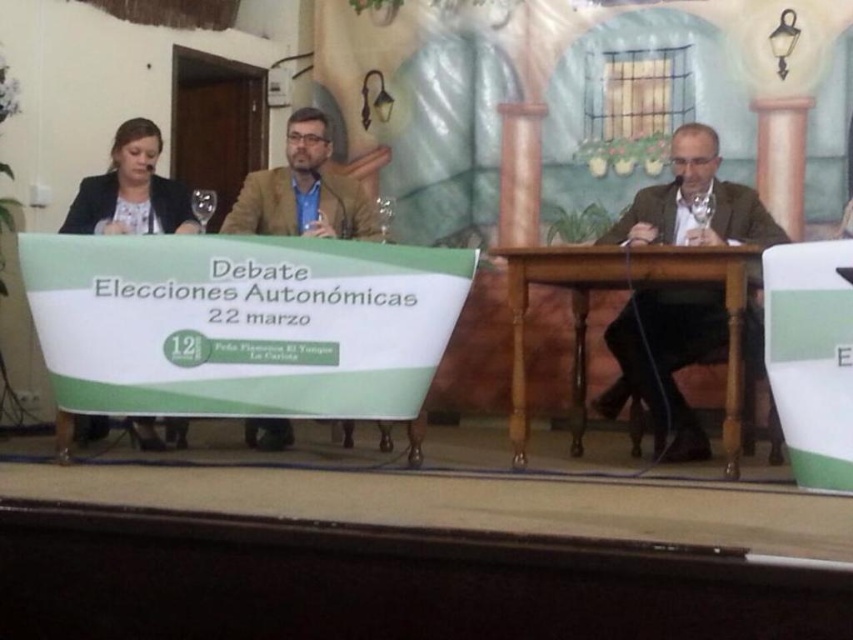
You are a photographer standing behind the table and want to capture a photo of the brown textured suit at center and the brown wooden table at center. Which object is closer to your camera lens?

The brown textured suit at center is located above the brown wooden table at center, so the brown textured suit at center is closer to your camera lens.

You are a photographer positioned behind the table. You need to adjust the lighting so that both the matte brown blazer at center and the matte black jacket at left are well illuminated. However, you can only focus the light on one of them. Which one should you prioritize to ensure the other is still somewhat visible?

The matte brown blazer at center is closer to you than the matte black jacket at left, so focusing the light on the matte brown blazer at center will also help illuminate the matte black jacket at left to some extent, ensuring both are somewhat visible.